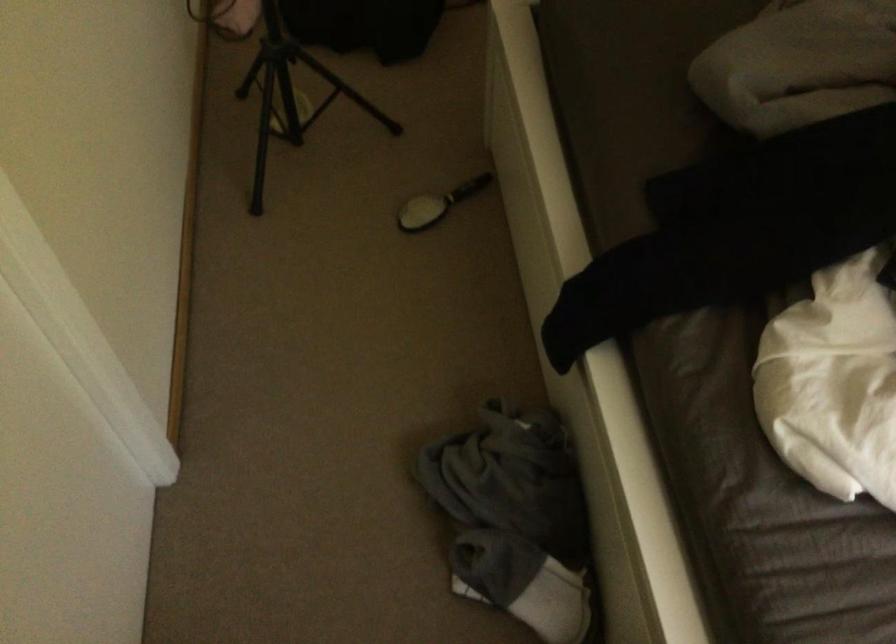
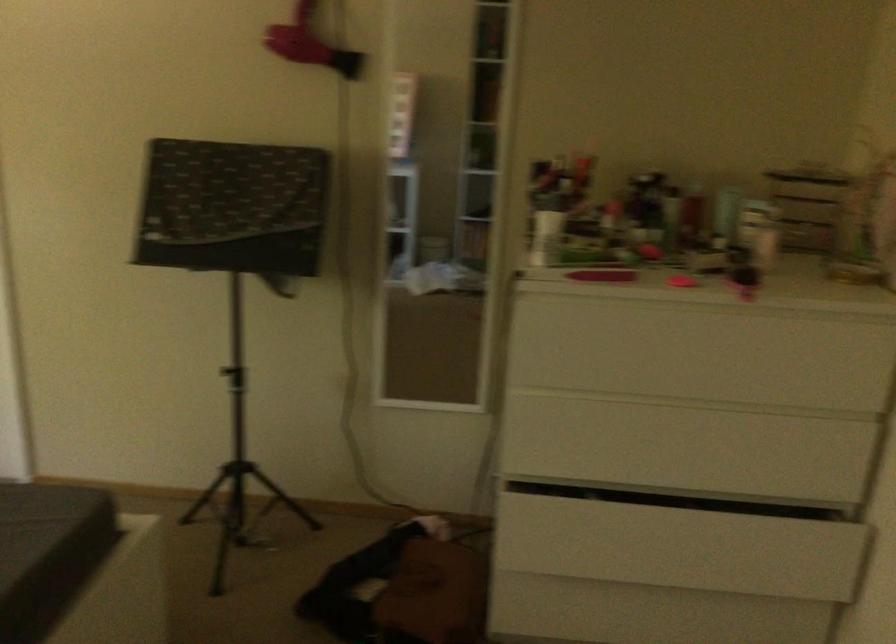
Question: I am providing you with two images of the same scene from different viewpoints. After the viewpoint changes to image2, which objects are now occluded?

Choices:
 (A) pink hairdryer
 (B) brown bag
 (C) black hairbrush
 (D) red bottle trigger

Answer: (C)